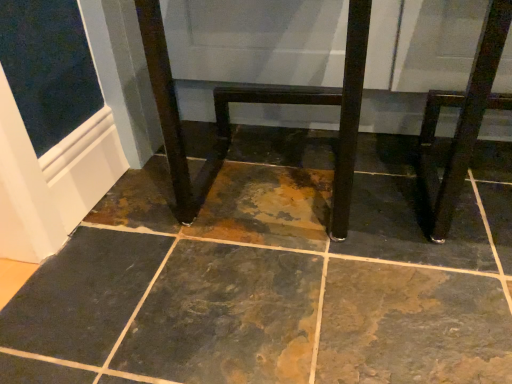
Question: Should I look upward or downward to see shiny dark wood stool at right?

Choices:
 (A) up
 (B) down

Answer: (A)

Question: Can you confirm if shiny dark wood stool at right is shorter than matte black table at center?

Choices:
 (A) no
 (B) yes

Answer: (B)

Question: From a real-world perspective, is shiny dark wood stool at right over matte black table at center?

Choices:
 (A) yes
 (B) no

Answer: (A)

Question: From the image's perspective, would you say shiny dark wood stool at right is shown under matte black table at center?

Choices:
 (A) no
 (B) yes

Answer: (B)

Question: Considering the relative sizes of shiny dark wood stool at right and matte black table at center in the image provided, is shiny dark wood stool at right thinner than matte black table at center?

Choices:
 (A) no
 (B) yes

Answer: (B)

Question: Is shiny dark wood stool at right bigger than matte black table at center?

Choices:
 (A) no
 (B) yes

Answer: (A)

Question: From the image's perspective, does shiny dark wood stool at right appear higher than matte black table at center?

Choices:
 (A) yes
 (B) no

Answer: (B)

Question: Is the position of matte black table at center less distant than that of shiny dark wood stool at right?

Choices:
 (A) no
 (B) yes

Answer: (A)

Question: Considering the relative positions of matte black table at center and shiny dark wood stool at right in the image provided, is matte black table at center behind shiny dark wood stool at right?

Choices:
 (A) no
 (B) yes

Answer: (B)

Question: Is matte black table at center bigger than shiny dark wood stool at right?

Choices:
 (A) no
 (B) yes

Answer: (B)

Question: Are matte black table at center and shiny dark wood stool at right located far from each other?

Choices:
 (A) yes
 (B) no

Answer: (B)

Question: Does matte black table at center have a greater height compared to shiny dark wood stool at right?

Choices:
 (A) no
 (B) yes

Answer: (B)

Question: From the image's perspective, is matte black table at center on top of shiny dark wood stool at right?

Choices:
 (A) no
 (B) yes

Answer: (B)

Question: From the image's perspective, relative to matte black table at center, is shiny dark wood stool at right above or below?

Choices:
 (A) above
 (B) below

Answer: (B)